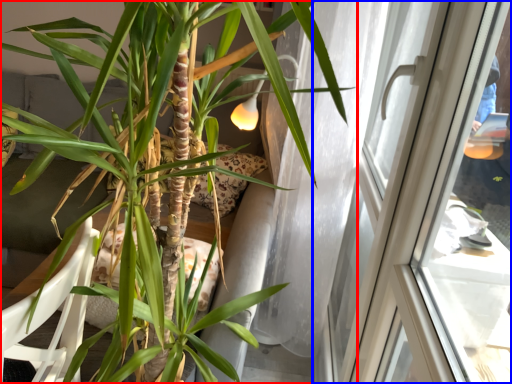
Question: Which object is further to the camera taking this photo, houseplant (highlighted by a red box) or window (highlighted by a blue box)?

Choices:
 (A) houseplant
 (B) window

Answer: (B)